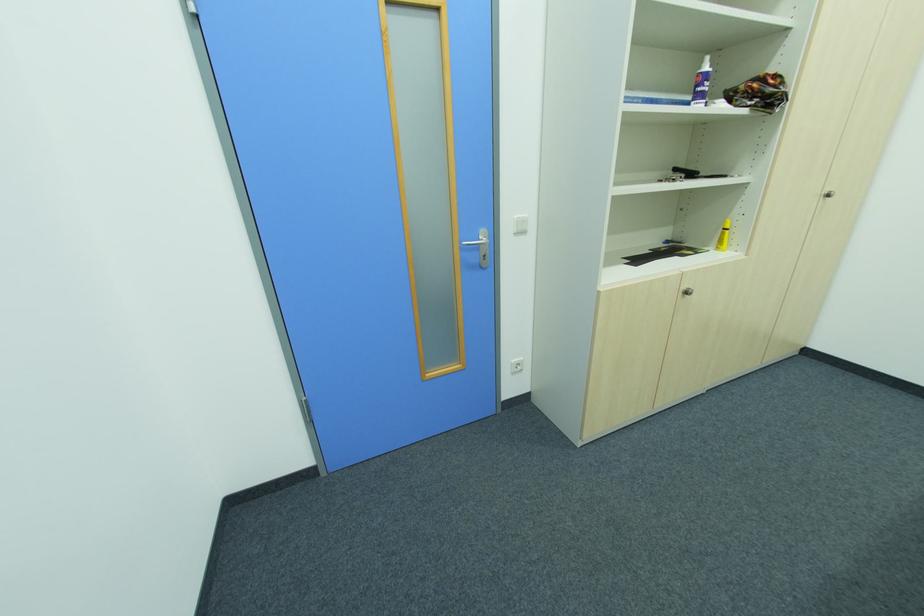
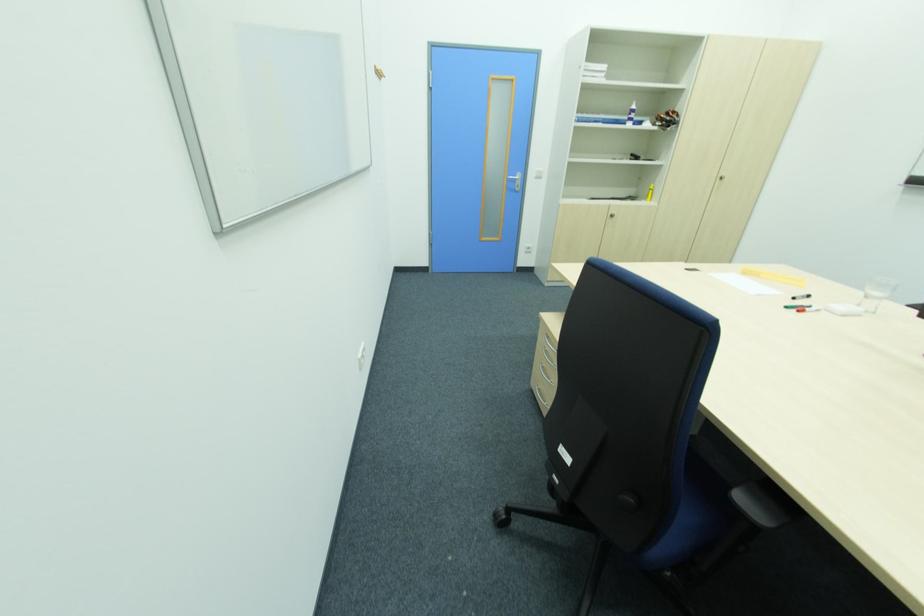
Question: In a continuous first-person perspective shot, in which direction is the camera moving?

Choices:
 (A) Left
 (B) Right
 (C) Forward
 (D) Backward

Answer: (D)